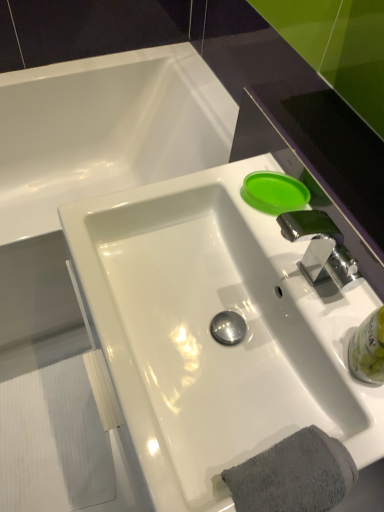
Where is `vacant point to the left of green matte lid at upper right, the 2th liquid positioned from the front`? The height and width of the screenshot is (512, 384). vacant point to the left of green matte lid at upper right, the 2th liquid positioned from the front is located at coordinates (216, 184).